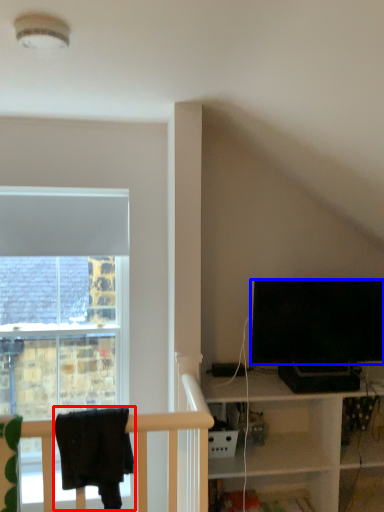
Question: Which of the following is the farthest to the observer, laundry (highlighted by a red box) or television (highlighted by a blue box)?

Choices:
 (A) laundry
 (B) television

Answer: (B)